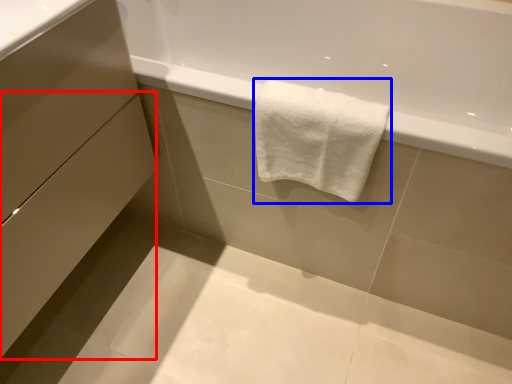
Question: Among these objects, which one is farthest to the camera, drawer (highlighted by a red box) or towel (highlighted by a blue box)?

Choices:
 (A) drawer
 (B) towel

Answer: (B)